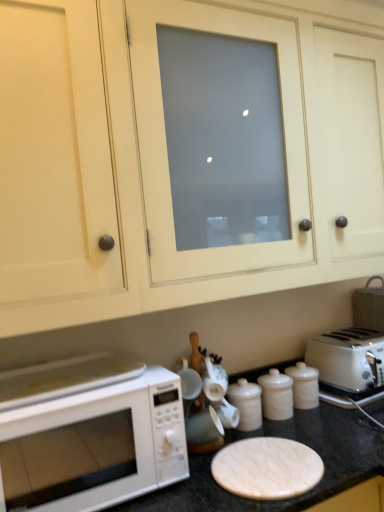
Question: In terms of size, does white plastic toaster at right appear bigger or smaller than white marble counter top at lower center?

Choices:
 (A) small
 (B) big

Answer: (A)

Question: Considering the positions of white plastic toaster at right and white marble counter top at lower center in the image, is white plastic toaster at right taller or shorter than white marble counter top at lower center?

Choices:
 (A) tall
 (B) short

Answer: (B)

Question: Which is farther from the white glossy canister at center?

Choices:
 (A) white plastic toaster at right
 (B) white matte microwave at lower left
 (C) white matte cabinet at upper center
 (D) white marble counter top at lower center

Answer: (C)

Question: Considering the real-world distances, which object is closest to the white matte microwave at lower left?

Choices:
 (A) white plastic toaster at right
 (B) white matte cabinet at upper center
 (C) white marble counter top at lower center
 (D) white glossy canister at center

Answer: (C)